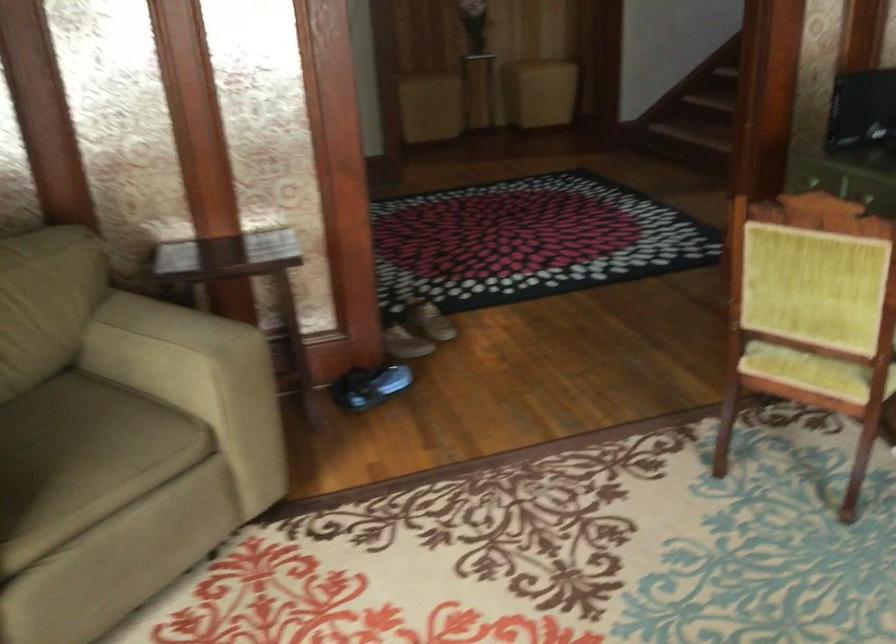
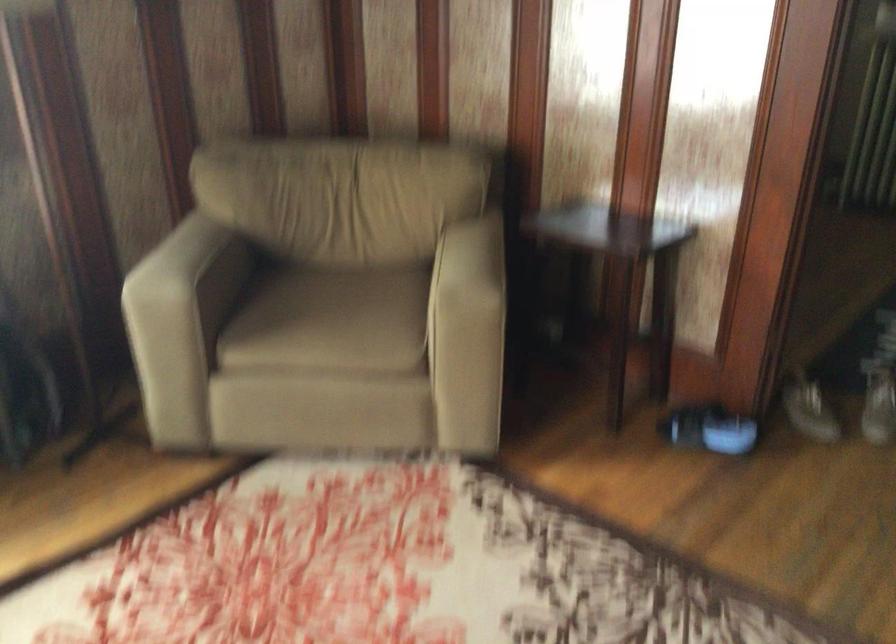
Locate, in the second image, the point that corresponds to point 80,451 in the first image.

(331, 321)